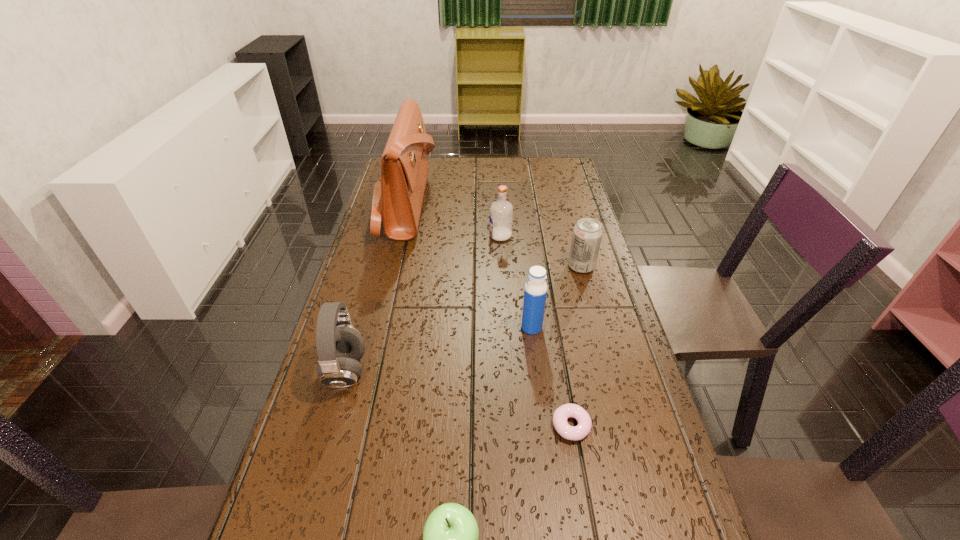
Image resolution: width=960 pixels, height=540 pixels. I want to click on doughnut present at the right edge, so click(x=574, y=433).

Find the location of a particular element. This screenshot has height=540, width=960. object that is at the far left corner is located at coordinates (398, 195).

At what (x,y) coordinates should I click in order to perform the action: click on vacant space at the far edge of the desktop. Please return your answer as a coordinate pair (x, y). Looking at the image, I should click on (507, 165).

Locate an element on the screen. The height and width of the screenshot is (540, 960). vacant area at the left edge is located at coordinates (369, 482).

In order to click on free region at the right edge of the desktop in this screenshot , I will do [x=564, y=307].

You are a GUI agent. You are given a task and a screenshot of the screen. Output one action in this format:
    pyautogui.click(x=<x>, y=<y>)
    Task: Click on the free space between the tallest object and the water bottle
    
    Given the screenshot: What is the action you would take?
    pyautogui.click(x=468, y=266)

Where is `vacant space that is in between the satchel and the fourth object from left to right`? vacant space that is in between the satchel and the fourth object from left to right is located at coordinates (453, 220).

I want to click on free area in between the vodka and the headset, so click(423, 304).

Locate an element on the screen. empty space between the water bottle and the rightmost object is located at coordinates (557, 297).

Identify the location of free space between the headset and the shortest object. (459, 399).